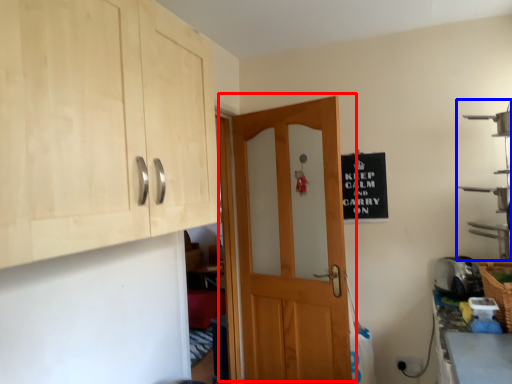
Question: Which object appears farthest to the camera in this image, door (highlighted by a red box) or shelf (highlighted by a blue box)?

Choices:
 (A) door
 (B) shelf

Answer: (A)